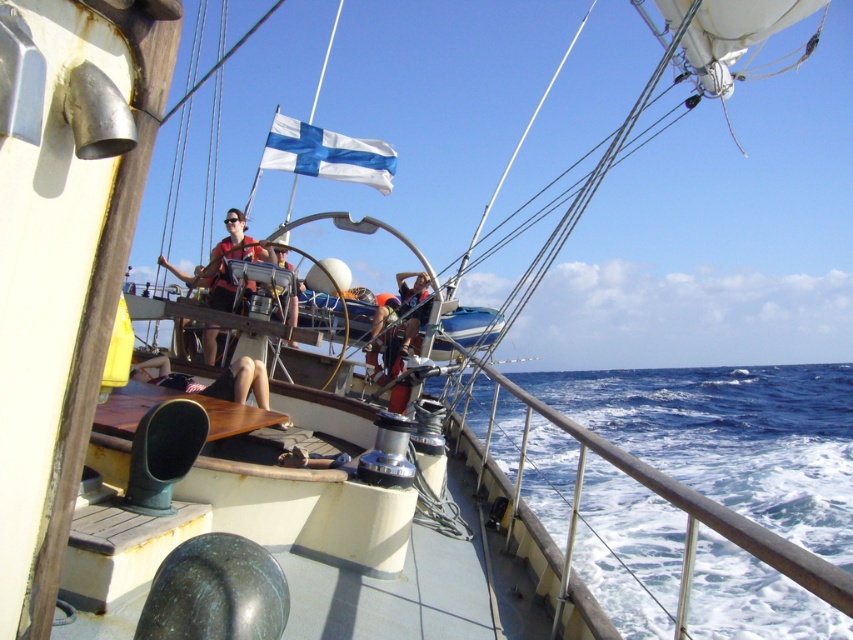
Which is more to the right, white fabric flag at upper center or wooden at center?

Positioned to the right is wooden at center.

Is white fabric flag at upper center positioned behind wooden at center?

Yes, white fabric flag at upper center is further from the viewer.

Does point (341, 164) come farther from viewer compared to point (161, 392)?

Yes.

You are a GUI agent. You are given a task and a screenshot of the screen. Output one action in this format:
    pyautogui.click(x=<x>, y=<y>)
    Task: Click on the white fabric flag at upper center
    This screenshot has width=853, height=640.
    Given the screenshot: What is the action you would take?
    pyautogui.click(x=328, y=154)

Between point (838, 428) and point (306, 125), which one is positioned in front?

Point (306, 125) is more forward.

Does blue water at lower right appear on the right side of white fabric flag at upper center?

Indeed, blue water at lower right is positioned on the right side of white fabric flag at upper center.

Describe the element at coordinates (732, 436) in the screenshot. The height and width of the screenshot is (640, 853). I see `blue water at lower right` at that location.

You are a GUI agent. You are given a task and a screenshot of the screen. Output one action in this format:
    pyautogui.click(x=<x>, y=<y>)
    Task: Click on the blue water at lower right
    
    Given the screenshot: What is the action you would take?
    pyautogui.click(x=732, y=436)

Does white fabric flag at upper center have a lesser height compared to matte gray shirt at center?

No.

Who is more distant from viewer, (366,170) or (294,324)?

The point (366,170) is behind.

Is point (299, 161) positioned before point (286, 268)?

No, it is behind (286, 268).

Locate an element on the screen. The image size is (853, 640). white fabric flag at upper center is located at coordinates (328, 154).